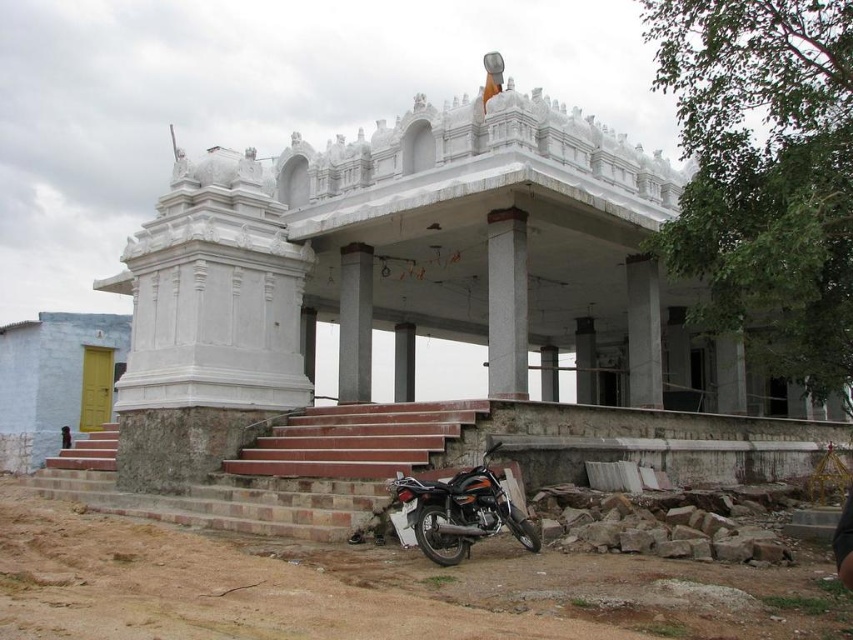
Question: Which point appears closest to the camera in this image?

Choices:
 (A) (495, 445)
 (B) (525, 340)
 (C) (285, 426)

Answer: (A)

Question: Is brick stairs at lower center smaller than smooth concrete pillar at center?

Choices:
 (A) no
 (B) yes

Answer: (A)

Question: Can you confirm if smooth concrete column at center is smaller than smooth concrete pillar at center?

Choices:
 (A) yes
 (B) no

Answer: (A)

Question: Which point is farther to the camera?

Choices:
 (A) shiny metallic motorbike at lower center
 (B) smooth concrete pillar at center
 (C) brick stairs at lower center

Answer: (B)

Question: Which object appears farthest from the camera in this image?

Choices:
 (A) smooth concrete pillar at center
 (B) shiny metallic motorbike at lower center

Answer: (A)

Question: Where is shiny metallic motorbike at lower center located in relation to smooth concrete column at center in the image?

Choices:
 (A) left
 (B) right

Answer: (A)